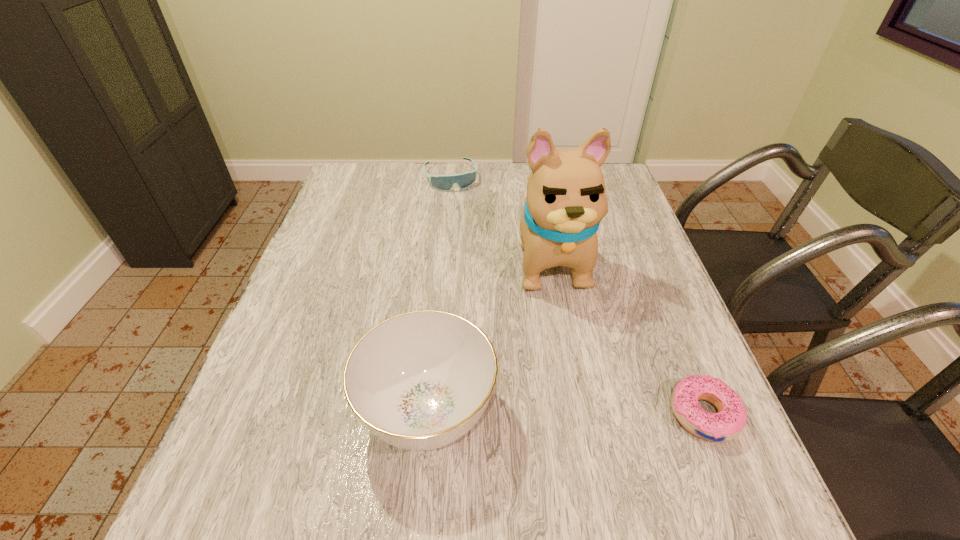
Image resolution: width=960 pixels, height=540 pixels. Identify the location of vacant space at the near edge of the desktop. (330, 430).

Locate an element on the screen. vacant space at the left edge of the desktop is located at coordinates (280, 334).

Identify the location of vacant space at the right edge of the desktop. The image size is (960, 540). (627, 226).

In the image, there is a desktop. Identify the location of vacant space at the far left corner. This screenshot has height=540, width=960. (x=380, y=171).

The height and width of the screenshot is (540, 960). In order to click on vacant space at the near left corner of the desktop in this screenshot , I will do `click(226, 436)`.

Where is `empty space that is in between the rightmost object and the third shortest object`? The height and width of the screenshot is (540, 960). empty space that is in between the rightmost object and the third shortest object is located at coordinates (565, 413).

Image resolution: width=960 pixels, height=540 pixels. In order to click on free space that is in between the chinaware and the rightmost object in this screenshot , I will do `click(565, 413)`.

The image size is (960, 540). Find the location of `free space between the goggles and the rightmost object`. free space between the goggles and the rightmost object is located at coordinates (577, 296).

At what (x,y) coordinates should I click in order to perform the action: click on unoccupied position between the rightmost object and the second tallest object. Please return your answer as a coordinate pair (x, y). The image size is (960, 540). Looking at the image, I should click on (565, 413).

I want to click on free space that is in between the shortest object and the farthest object, so click(577, 296).